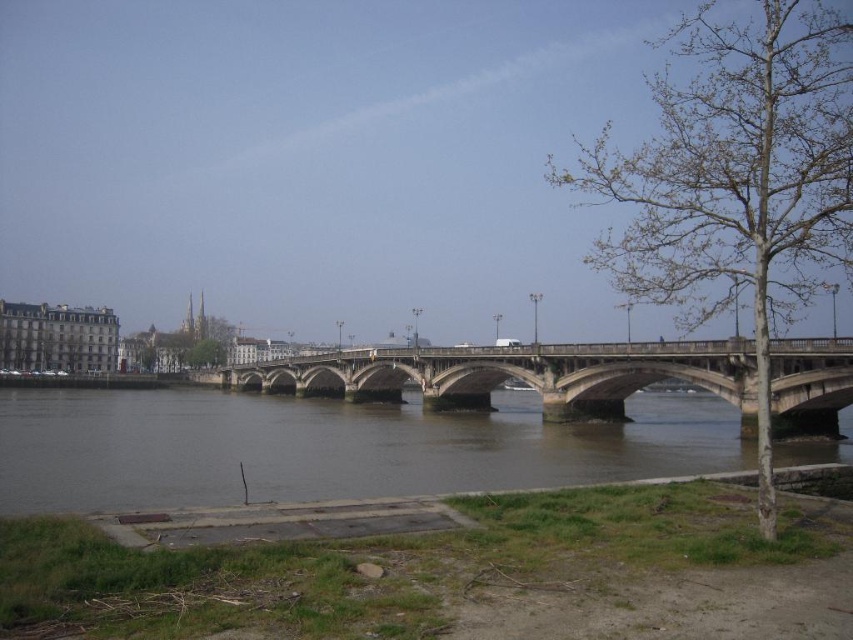
Question: Is brown muddy water at lower center bigger than bare wood tree at right?

Choices:
 (A) yes
 (B) no

Answer: (B)

Question: Can you confirm if bare wood tree at right is positioned to the right of concrete bridge at center?

Choices:
 (A) no
 (B) yes

Answer: (B)

Question: Considering the real-world distances, which object is closest to the bare wood tree at right?

Choices:
 (A) brown muddy water at lower center
 (B) concrete bridge at center
 (C) green leafy tree at center

Answer: (A)

Question: Is concrete bridge at center positioned before green leafy tree at center?

Choices:
 (A) no
 (B) yes

Answer: (B)

Question: Estimate the real-world distances between objects in this image. Which object is closer to the green leafy tree at center?

Choices:
 (A) bare wood tree at right
 (B) brown muddy water at lower center
 (C) concrete bridge at center

Answer: (C)

Question: Which of the following is the farthest from the observer?

Choices:
 (A) green leafy tree at center
 (B) brown muddy water at lower center
 (C) concrete bridge at center
 (D) bare wood tree at right

Answer: (A)